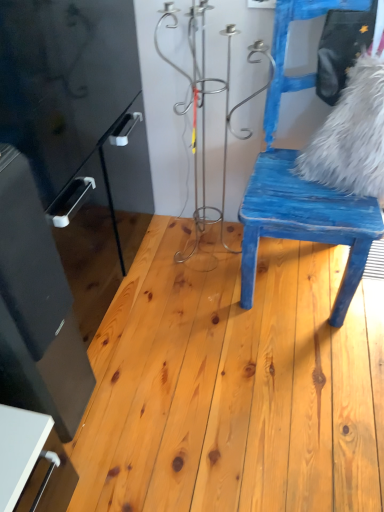
What is the approximate height of blue distressed wood chair at right?

The height of blue distressed wood chair at right is 1.00 meters.

Looking at this image, measure the distance between white fluffy pillow at upper right and camera.

The depth of white fluffy pillow at upper right is 3.98 feet.

Locate an element on the screen. blue distressed wood chair at right is located at coordinates (302, 183).

Is white fluffy pillow at upper right positioned beyond the bounds of blue distressed wood chair at right?

No, white fluffy pillow at upper right is not outside of blue distressed wood chair at right.

Is white fluffy pillow at upper right looking in the opposite direction of blue distressed wood chair at right?

That's right, white fluffy pillow at upper right is facing away from blue distressed wood chair at right.

Can you confirm if white fluffy pillow at upper right is smaller than blue distressed wood chair at right?

Indeed, white fluffy pillow at upper right has a smaller size compared to blue distressed wood chair at right.

Considering the sizes of objects white fluffy pillow at upper right and blue distressed wood chair at right in the image provided, who is thinner, white fluffy pillow at upper right or blue distressed wood chair at right?

white fluffy pillow at upper right is thinner.

Is blue distressed wood chair at right outside of white fluffy pillow at upper right?

Indeed, blue distressed wood chair at right is completely outside white fluffy pillow at upper right.

Between blue distressed wood chair at right and white fluffy pillow at upper right, which one appears on the right side from the viewer's perspective?

white fluffy pillow at upper right is more to the right.

Is blue distressed wood chair at right beside white fluffy pillow at upper right?

No.

Considering the sizes of blue distressed wood chair at right and white fluffy pillow at upper right in the image, is blue distressed wood chair at right wider or thinner than white fluffy pillow at upper right?

Clearly, blue distressed wood chair at right has more width compared to white fluffy pillow at upper right.

Is natural wood floor at center at the back of blue distressed wood chair at right?

No, blue distressed wood chair at right's orientation is not away from natural wood floor at center.

Choose the correct answer: Is blue distressed wood chair at right inside natural wood floor at center or outside it?

blue distressed wood chair at right is not inside natural wood floor at center, it's outside.

Is blue distressed wood chair at right positioned behind natural wood floor at center?

No, blue distressed wood chair at right is closer to the viewer.

Can you see blue distressed wood chair at right touching natural wood floor at center?

blue distressed wood chair at right is not next to natural wood floor at center, and they're not touching.

From a real-world perspective, who is located higher, natural wood floor at center or white fluffy pillow at upper right?

white fluffy pillow at upper right.

Is natural wood floor at center thinner than white fluffy pillow at upper right?

No.

Is natural wood floor at center closer to the viewer compared to white fluffy pillow at upper right?

Yes, natural wood floor at center is closer to the viewer.

Where is `animal behind the natural wood floor at center`? This screenshot has height=512, width=384. animal behind the natural wood floor at center is located at coordinates (351, 136).

Consider the image. How different are the orientations of white fluffy pillow at upper right and natural wood floor at center in degrees?

There is a 88.3-degree angle between the facing directions of white fluffy pillow at upper right and natural wood floor at center.

Could you tell me if white fluffy pillow at upper right is facing natural wood floor at center?

No, white fluffy pillow at upper right is not oriented towards natural wood floor at center.

Considering the positions of point (321, 153) and point (103, 387), is point (321, 153) closer or farther from the camera than point (103, 387)?

Point (321, 153) is closer to the camera than point (103, 387).

Is white fluffy pillow at upper right spatially inside natural wood floor at center, or outside of it?

white fluffy pillow at upper right exists outside the volume of natural wood floor at center.

How different are the orientations of natural wood floor at center and blue distressed wood chair at right in degrees?

88.3 degrees separate the facing orientations of natural wood floor at center and blue distressed wood chair at right.

Image resolution: width=384 pixels, height=512 pixels. I want to click on chair above the natural wood floor at center (from the image's perspective), so click(x=302, y=183).

Which point is more distant from viewer, [361,392] or [302,10]?

The point [302,10] is more distant.

In the image, there is a blue distressed wood chair at right. At what (x,y) coordinates should I click in order to perform the action: click on animal above it (from the image's perspective). Please return your answer as a coordinate pair (x, y). The width and height of the screenshot is (384, 512). Looking at the image, I should click on (351, 136).

What are the coordinates of `animal beneath the blue distressed wood chair at right (from a real-world perspective)` in the screenshot? It's located at (351, 136).

Based on the photo, when comparing their distances from white fluffy pillow at upper right, does natural wood floor at center or blue distressed wood chair at right seem closer?

Among the two, blue distressed wood chair at right is located nearer to white fluffy pillow at upper right.

From the picture: When comparing their distances from white fluffy pillow at upper right, does blue distressed wood chair at right or natural wood floor at center seem closer?

blue distressed wood chair at right is positioned closer to the anchor white fluffy pillow at upper right.

From the image, which object appears to be nearer to natural wood floor at center, blue distressed wood chair at right or white fluffy pillow at upper right?

blue distressed wood chair at right lies closer to natural wood floor at center than the other object.

Based on their spatial positions, is white fluffy pillow at upper right or natural wood floor at center further from blue distressed wood chair at right?

natural wood floor at center.

Looking at the image, which one is located closer to natural wood floor at center, white fluffy pillow at upper right or blue distressed wood chair at right?

blue distressed wood chair at right.

When comparing their distances from blue distressed wood chair at right, does natural wood floor at center or white fluffy pillow at upper right seem closer?

Among the two, white fluffy pillow at upper right is located nearer to blue distressed wood chair at right.

This screenshot has width=384, height=512. Identify the location of chair between white fluffy pillow at upper right and natural wood floor at center in the vertical direction. (302, 183).